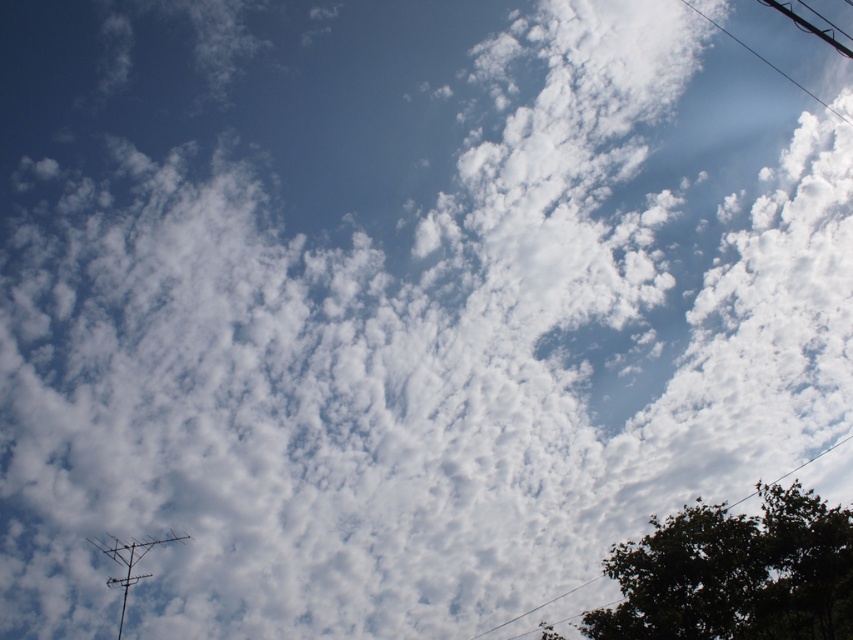
Question: Among these objects, which one is farthest from the camera?

Choices:
 (A) dark green leafy tree at lower right
 (B) black wire at upper right
 (C) metallic silver antenna at lower left

Answer: (B)

Question: In this image, where is metallic silver antenna at lower left located relative to black wire at upper right?

Choices:
 (A) above
 (B) below

Answer: (B)

Question: Can you confirm if dark green leafy tree at lower right is thinner than metallic silver antenna at lower left?

Choices:
 (A) no
 (B) yes

Answer: (A)

Question: Is dark green leafy tree at lower right wider than metallic silver antenna at lower left?

Choices:
 (A) yes
 (B) no

Answer: (A)

Question: Considering the real-world distances, which object is farthest from the black wire at upper right?

Choices:
 (A) metallic silver antenna at lower left
 (B) dark green leafy tree at lower right

Answer: (A)

Question: Which of the following is the closest to the observer?

Choices:
 (A) dark green leafy tree at lower right
 (B) black wire at upper right

Answer: (A)